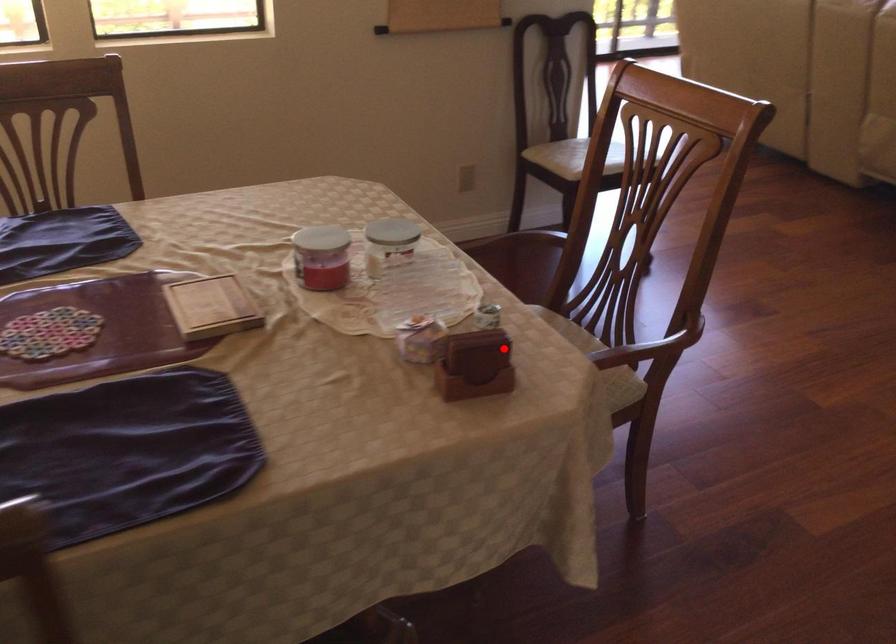
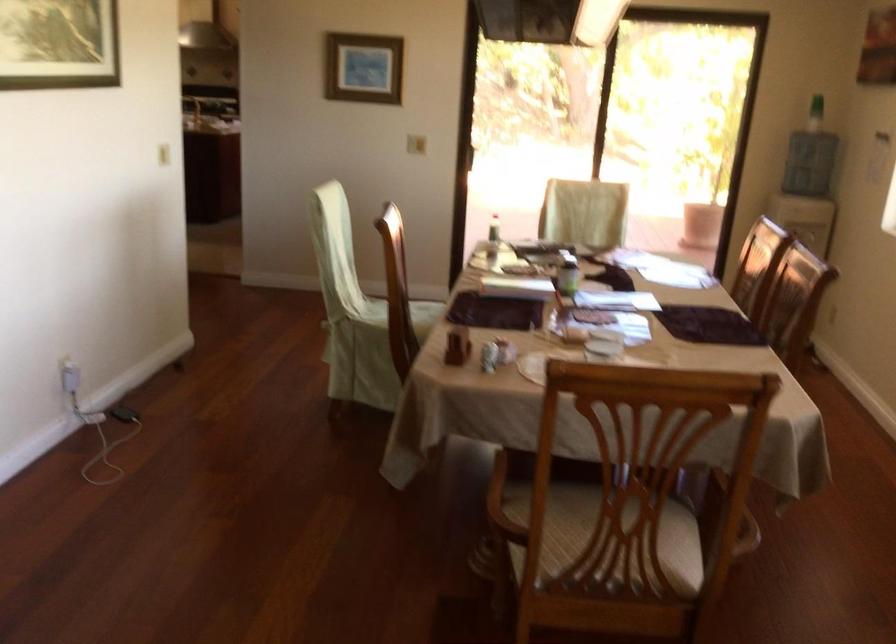
In the second image, find the point that corresponds to the highlighted location in the first image.

(458, 345)